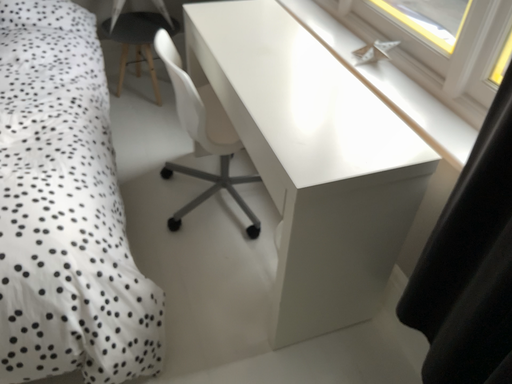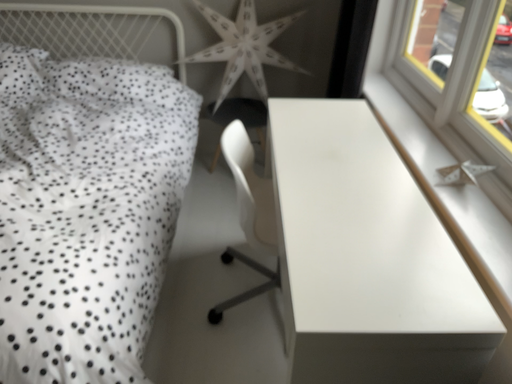
Question: How did the camera likely rotate when shooting the video?

Choices:
 (A) rotated downward
 (B) rotated upward

Answer: (B)